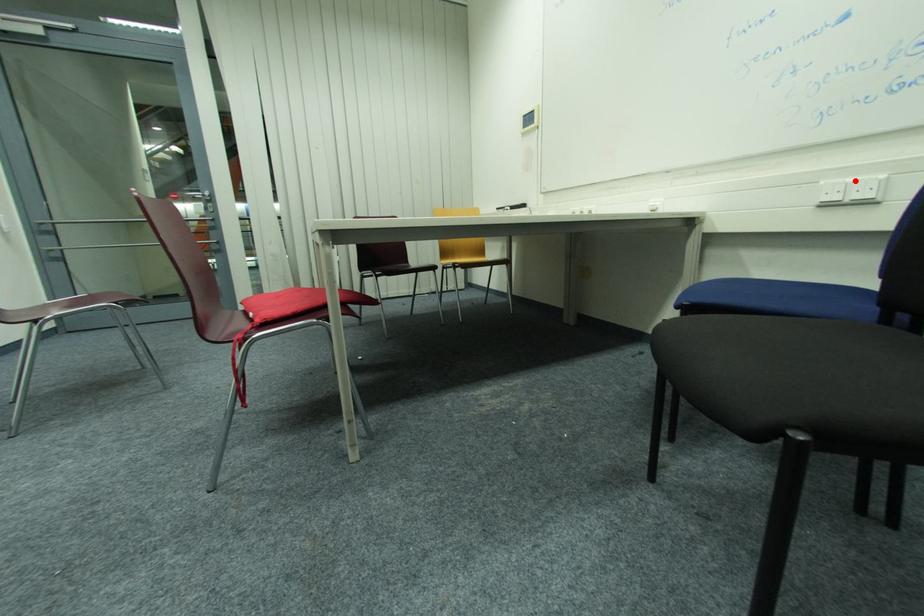
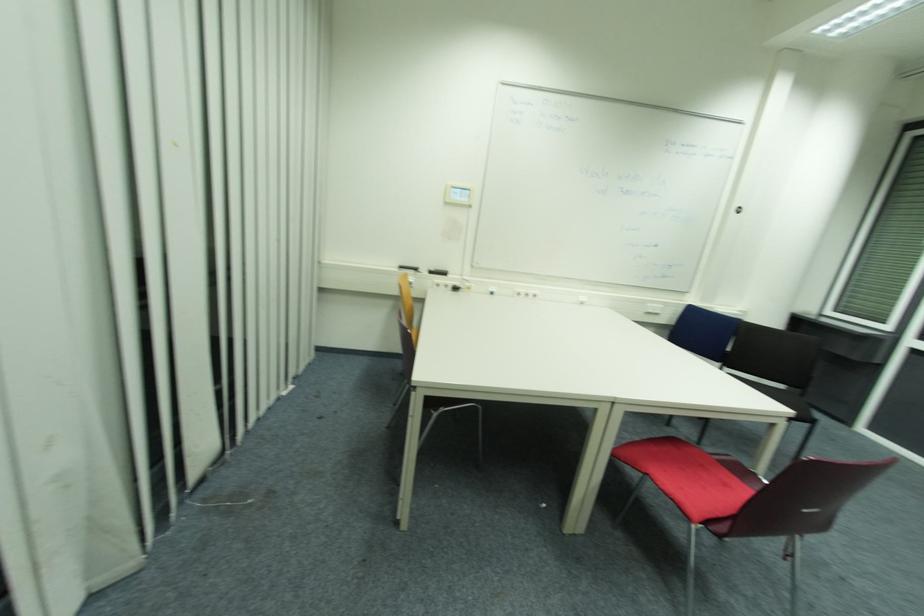
Question: I am providing you with two images of the same scene from different viewpoints. Given a red point in image1, look at the same physical point in image2. Is it:

Choices:
 (A) Closer to the viewpoint
 (B) Farther from the viewpoint

Answer: (A)